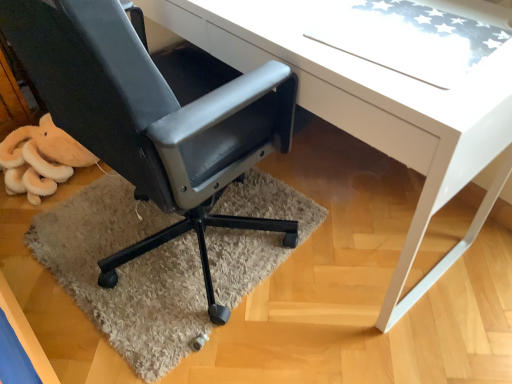
What do you see at coordinates (155, 115) in the screenshot?
I see `matte black office chair at lower left` at bounding box center [155, 115].

The width and height of the screenshot is (512, 384). In order to click on matte black office chair at lower left in this screenshot , I will do `click(155, 115)`.

From the image's perspective, is matte black office chair at lower left located above beige shaggy rug at lower left?

Yes, from the image's perspective, matte black office chair at lower left is on top of beige shaggy rug at lower left.

Does point (132, 179) come in front of point (208, 325)?

Yes, point (132, 179) is closer to viewer.

Is matte black office chair at lower left in contact with beige shaggy rug at lower left?

No, matte black office chair at lower left is not touching beige shaggy rug at lower left.

Is white glossy desk at center placed right next to matte black office chair at lower left?

No, white glossy desk at center is not in contact with matte black office chair at lower left.

What's the angular difference between white glossy desk at center and matte black office chair at lower left's facing directions?

They differ by 180 degrees in their facing directions.

Is white glossy desk at center positioned behind matte black office chair at lower left?

That is True.

From a real-world perspective, which is physically above, white glossy desk at center or matte black office chair at lower left?

matte black office chair at lower left.

Considering the relative sizes of white glossy desk at center and beige shaggy rug at lower left in the image provided, is white glossy desk at center thinner than beige shaggy rug at lower left?

Yes, white glossy desk at center is thinner than beige shaggy rug at lower left.

Is white glossy desk at center oriented away from beige shaggy rug at lower left?

No.

Between white glossy desk at center and beige shaggy rug at lower left, which one has larger size?

white glossy desk at center.

How far apart are white glossy desk at center and beige shaggy rug at lower left?

white glossy desk at center is 26.46 inches away from beige shaggy rug at lower left.

From the image's perspective, which one is positioned higher, matte black office chair at lower left or white glossy desk at center?

white glossy desk at center appears higher in the image.

Is matte black office chair at lower left turned away from white glossy desk at center?

Yes, matte black office chair at lower left's orientation is away from white glossy desk at center.

This screenshot has width=512, height=384. Identify the location of desk to the right of matte black office chair at lower left. (370, 110).

Is beige shaggy rug at lower left next to white glossy desk at center and touching it?

No, beige shaggy rug at lower left is not beside white glossy desk at center.

Locate an element on the screen. desk above the beige shaggy rug at lower left (from a real-world perspective) is located at coordinates (370, 110).

Considering the positions of objects beige shaggy rug at lower left and white glossy desk at center in the image provided, who is more to the right, beige shaggy rug at lower left or white glossy desk at center?

white glossy desk at center is more to the right.

Does point (85, 211) come behind point (329, 113)?

Yes, point (85, 211) is farther from viewer.

Relative to matte black office chair at lower left, is beige shaggy rug at lower left in front or behind?

beige shaggy rug at lower left is behind matte black office chair at lower left.

Which point is more distant from viewer, [227,289] or [129,77]?

The point [227,289] is farther.

From the image's perspective, is beige shaggy rug at lower left over matte black office chair at lower left?

No, from the image's perspective, beige shaggy rug at lower left is not above matte black office chair at lower left.

Identify the location of chair above the beige shaggy rug at lower left (from the image's perspective). (155, 115).

Find the location of `desk below the matte black office chair at lower left (from a real-world perspective)`. desk below the matte black office chair at lower left (from a real-world perspective) is located at coordinates (370, 110).

From the image, which object appears to be farther from matte black office chair at lower left, white glossy desk at center or beige shaggy rug at lower left?

beige shaggy rug at lower left lies further to matte black office chair at lower left than the other object.

From the image, which object appears to be nearer to white glossy desk at center, beige shaggy rug at lower left or matte black office chair at lower left?

matte black office chair at lower left lies closer to white glossy desk at center than the other object.

From the image, which object appears to be farther from beige shaggy rug at lower left, white glossy desk at center or matte black office chair at lower left?

Among the two, white glossy desk at center is located further to beige shaggy rug at lower left.

Estimate the real-world distances between objects in this image. Which object is further from beige shaggy rug at lower left, matte black office chair at lower left or white glossy desk at center?

Among the two, white glossy desk at center is located further to beige shaggy rug at lower left.

When comparing their distances from white glossy desk at center, does matte black office chair at lower left or beige shaggy rug at lower left seem further?

Among the two, beige shaggy rug at lower left is located further to white glossy desk at center.

Estimate the real-world distances between objects in this image. Which object is closer to matte black office chair at lower left, beige shaggy rug at lower left or white glossy desk at center?

The object closer to matte black office chair at lower left is white glossy desk at center.

This screenshot has height=384, width=512. In order to click on desk positioned between matte black office chair at lower left and beige shaggy rug at lower left from near to far in this screenshot , I will do `click(370, 110)`.